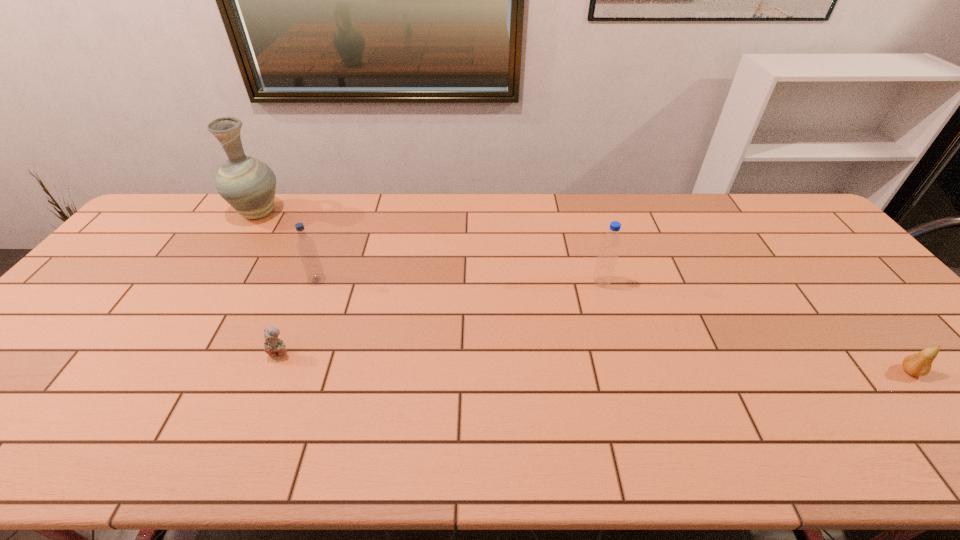
The width and height of the screenshot is (960, 540). Identify the location of vacant space that satisfies the following two spatial constraints: 1. on the front-facing side of the rightmost object; 2. on the right side of the fourth farthest object. (273, 372).

Locate an element on the screen. The height and width of the screenshot is (540, 960). vacant area in the image that satisfies the following two spatial constraints: 1. on the front side of the left water bottle; 2. on the right side of the pear is located at coordinates (280, 372).

The width and height of the screenshot is (960, 540). Find the location of `free space that satisfies the following two spatial constraints: 1. on the front side of the fourth object from left to right; 2. on the right side of the left water bottle`. free space that satisfies the following two spatial constraints: 1. on the front side of the fourth object from left to right; 2. on the right side of the left water bottle is located at coordinates (316, 282).